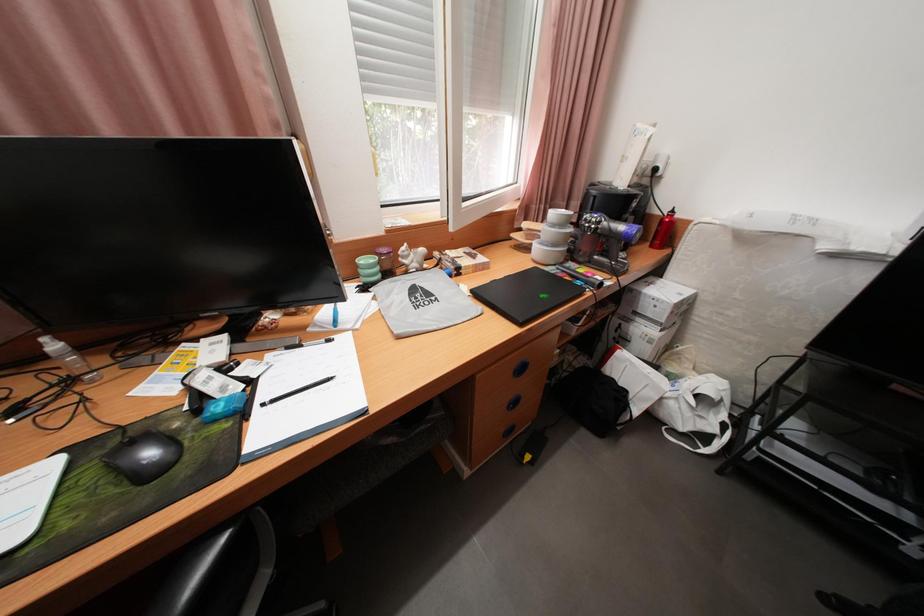
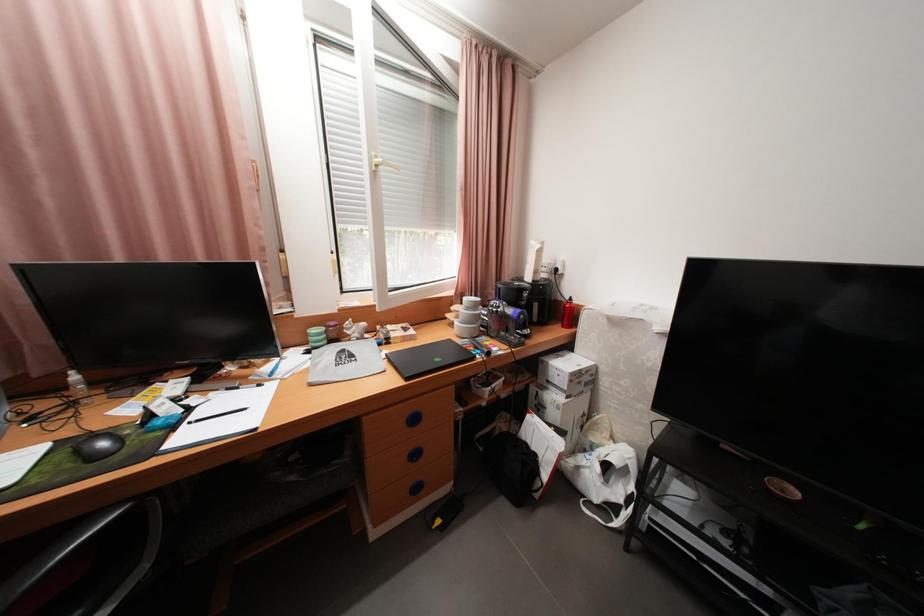
Question: How did the camera likely rotate?

Choices:
 (A) Left
 (B) Right
 (C) Up
 (D) Down

Answer: (C)